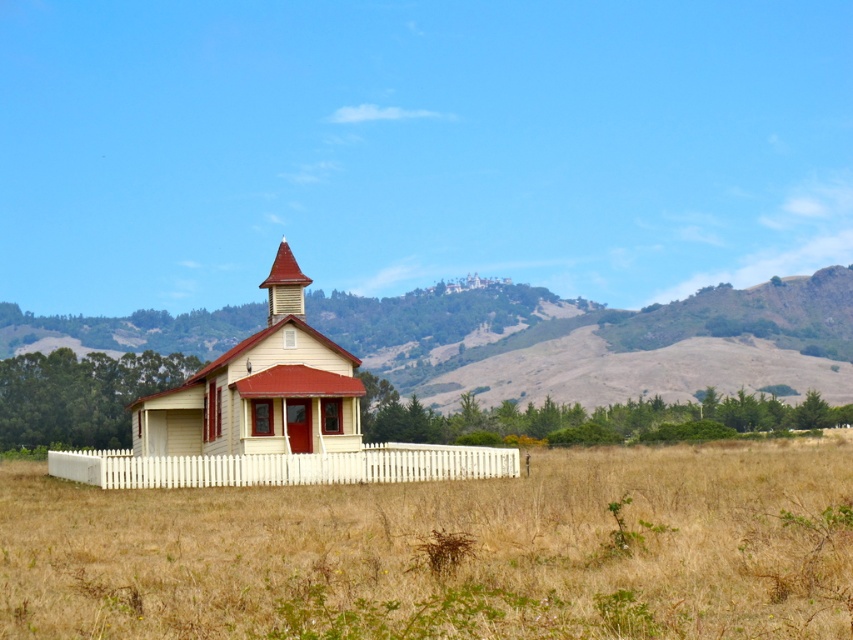
Can you confirm if dry grass at center is taller than shiny red wood spire at center?

Indeed, dry grass at center has a greater height compared to shiny red wood spire at center.

Does dry grass at center come in front of shiny red wood spire at center?

Yes, dry grass at center is in front of shiny red wood spire at center.

Image resolution: width=853 pixels, height=640 pixels. What do you see at coordinates (453, 563) in the screenshot?
I see `dry grass at center` at bounding box center [453, 563].

Identify the location of dry grass at center. Image resolution: width=853 pixels, height=640 pixels. (453, 563).

Can you confirm if dry grass at center is positioned to the left of rugged brown hillside at center?

Incorrect, dry grass at center is not on the left side of rugged brown hillside at center.

Is point (103, 586) positioned before point (833, 355)?

Yes.

I want to click on dry grass at center, so click(453, 563).

Between point (846, 276) and point (303, 387), which one is positioned behind?

Point (846, 276)

Does rugged brown hillside at center appear over light yellow wood church at center?

Incorrect, rugged brown hillside at center is not positioned above light yellow wood church at center.

Locate an element on the screen. This screenshot has height=640, width=853. rugged brown hillside at center is located at coordinates (590, 339).